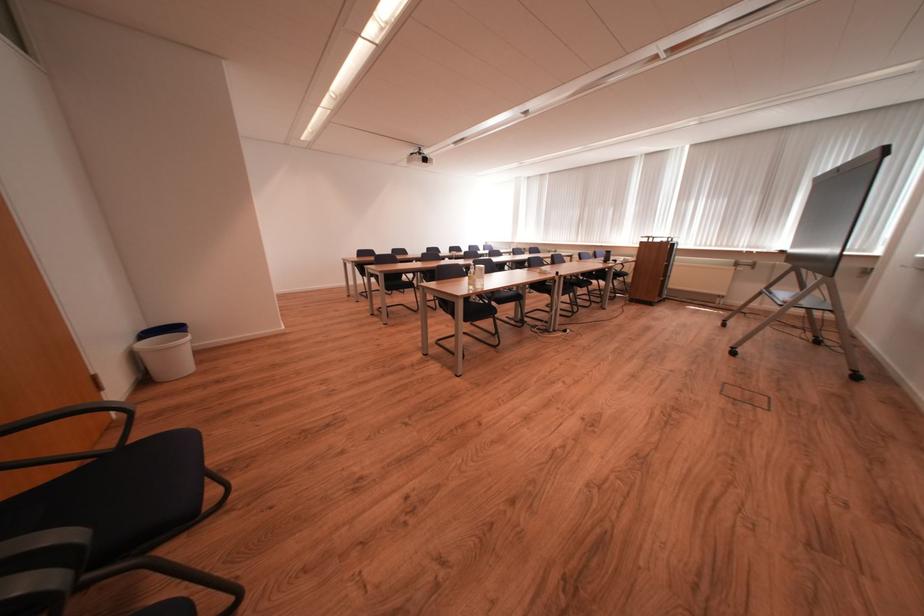
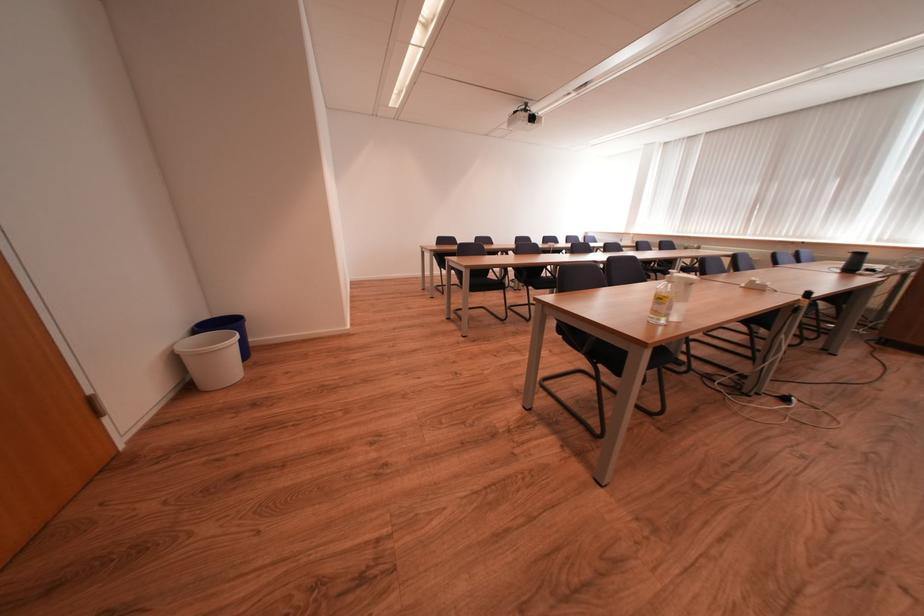
Find the pixel in the second image that matches (x=483, y=283) in the first image.

(678, 310)